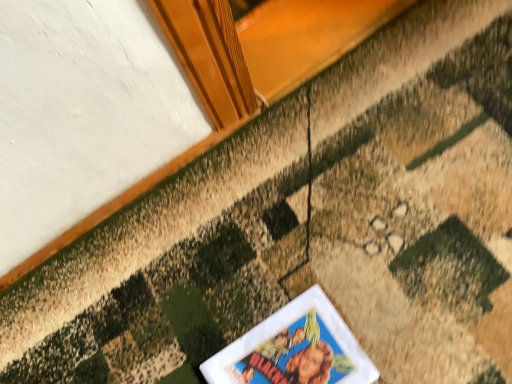
This screenshot has width=512, height=384. What do you see at coordinates (295, 356) in the screenshot?
I see `white glossy comic book at lower center` at bounding box center [295, 356].

The height and width of the screenshot is (384, 512). In order to click on white glossy comic book at lower center in this screenshot , I will do `click(295, 356)`.

Identify the location of white glossy comic book at lower center. This screenshot has height=384, width=512. (295, 356).